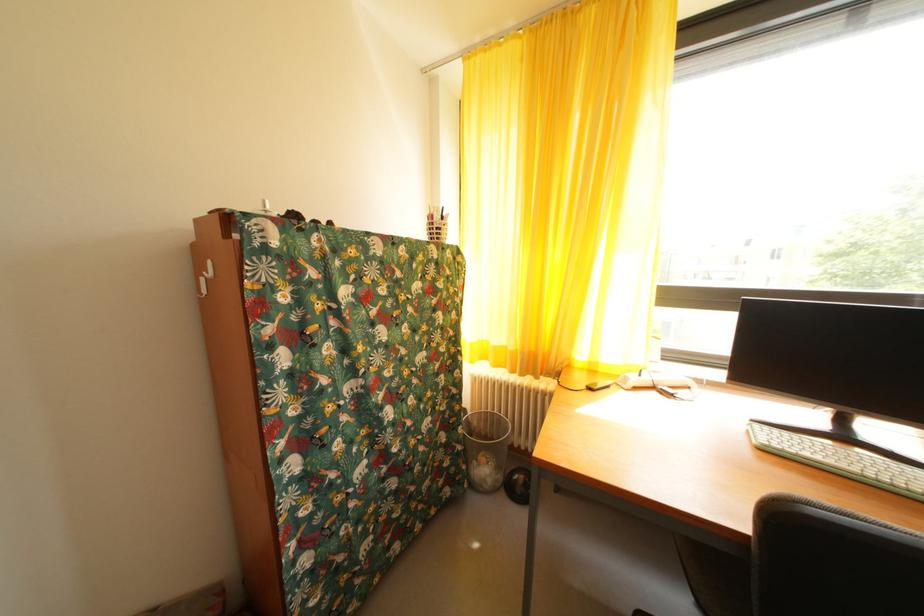
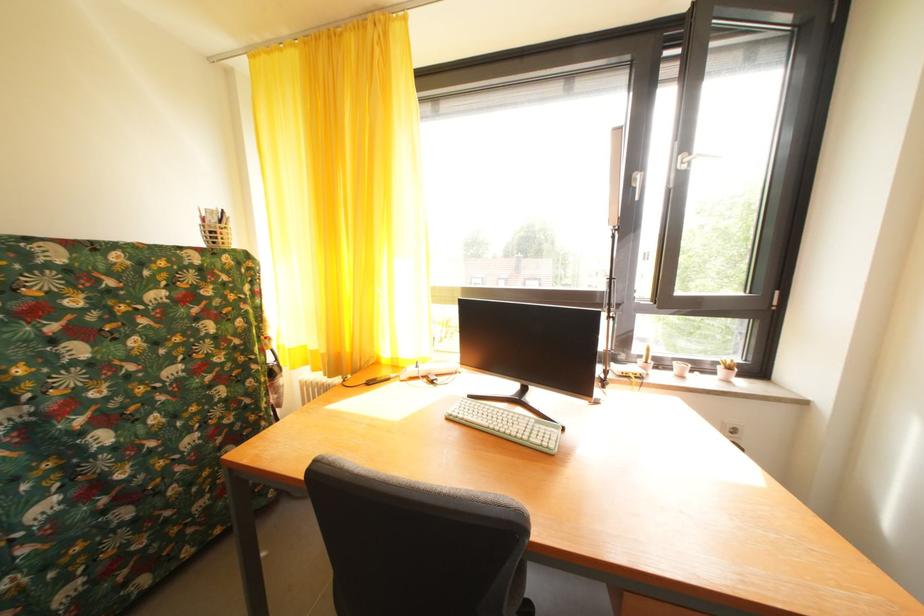
The point at (434, 227) is marked in the first image. Where is the corresponding point in the second image?

(209, 229)